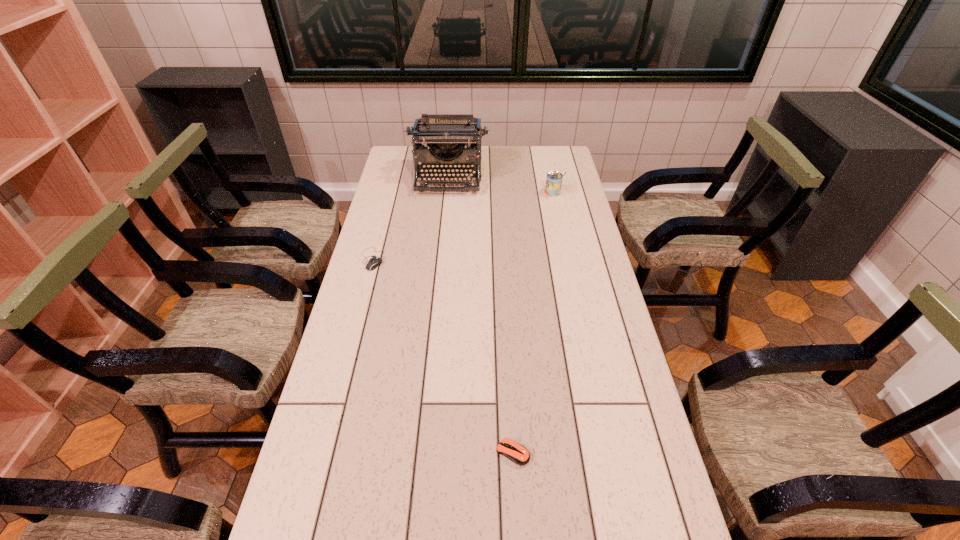
I want to click on the second closest object relative to the second tallest object, so pyautogui.click(x=372, y=264).

Locate an element on the screen. object that stands as the third closest to the typewriter is located at coordinates (517, 453).

Find the location of `vacant space that satisfies the following two spatial constraints: 1. on the typing side of the rightmost object; 2. on the left side of the tallest object`. vacant space that satisfies the following two spatial constraints: 1. on the typing side of the rightmost object; 2. on the left side of the tallest object is located at coordinates (446, 192).

Image resolution: width=960 pixels, height=540 pixels. I want to click on vacant space that satisfies the following two spatial constraints: 1. on the back side of the second nearest object; 2. on the right side of the rightmost object, so click(390, 192).

The height and width of the screenshot is (540, 960). In order to click on free point that satisfies the following two spatial constraints: 1. on the back side of the can; 2. on the right side of the nearer computer mouse in this screenshot , I will do `click(499, 192)`.

This screenshot has height=540, width=960. In order to click on vacant space that satisfies the following two spatial constraints: 1. on the back side of the leftmost object; 2. on the left side of the rightmost object in this screenshot , I will do `click(390, 192)`.

This screenshot has width=960, height=540. I want to click on blank space that satisfies the following two spatial constraints: 1. on the back side of the farther computer mouse; 2. on the right side of the second tallest object, so click(x=390, y=192).